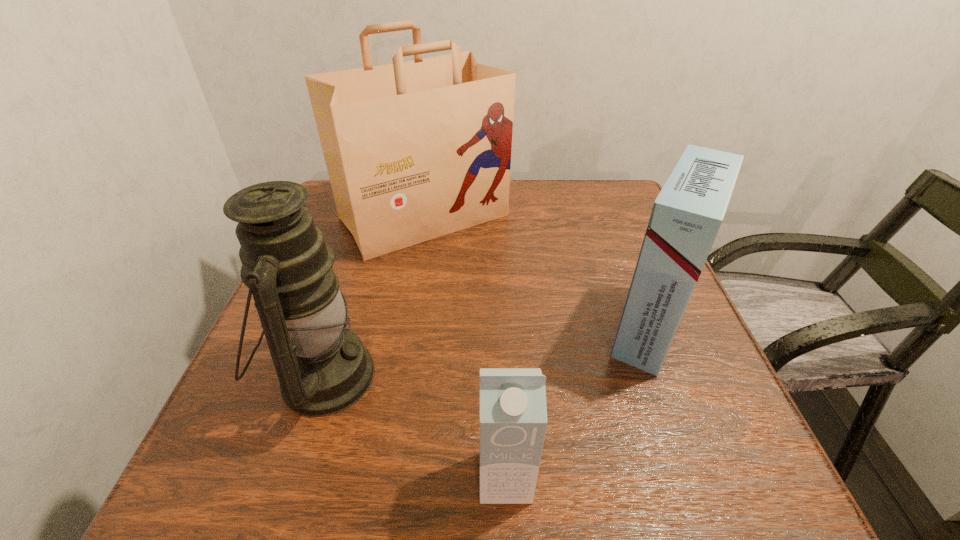
Identify the location of the farthest object. The image size is (960, 540). (416, 150).

What are the coordinates of `oil lamp` in the screenshot? It's located at (323, 368).

Locate an element on the screen. cigarette case is located at coordinates (686, 216).

Locate an element on the screen. This screenshot has width=960, height=540. the shortest object is located at coordinates (513, 414).

You are a GUI agent. You are given a task and a screenshot of the screen. Output one action in this format:
    pyautogui.click(x=<x>, y=<y>)
    Task: Click on the nearest object
    
    Given the screenshot: What is the action you would take?
    pyautogui.click(x=513, y=414)

Identify the location of vacant area situated 0.200m on the side of the farthest object with the superhero design. (405, 327).

The image size is (960, 540). Identify the location of free space located 0.330m on the back of the oil lamp. (372, 228).

Locate an element on the screen. The image size is (960, 540). vacant space located on the left of the rightmost object is located at coordinates (550, 328).

Locate an element on the screen. object at the far edge is located at coordinates (416, 150).

The width and height of the screenshot is (960, 540). In order to click on object located at the near edge in this screenshot , I will do coord(513,414).